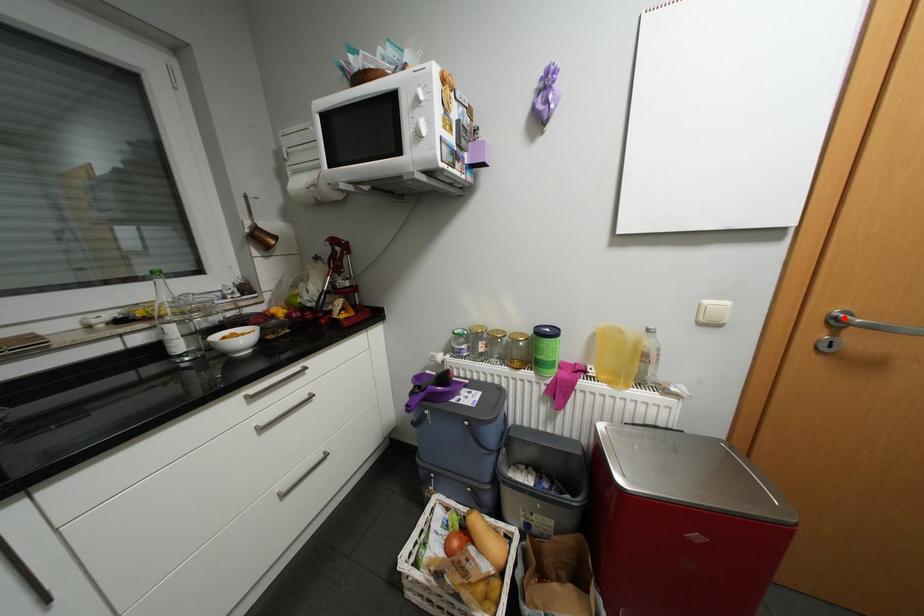
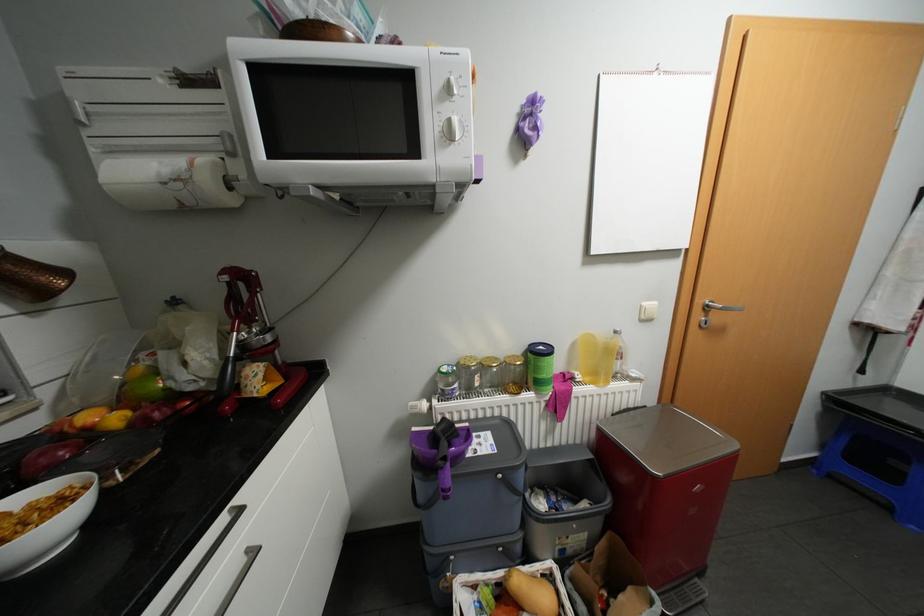
In the second image, find the point that corresponds to the highlighted location in the first image.

(715, 305)